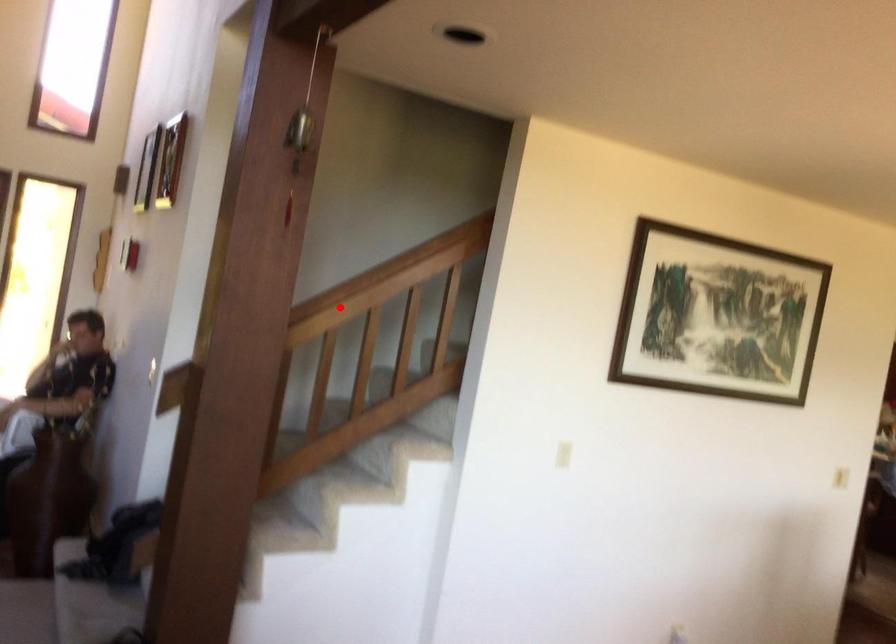
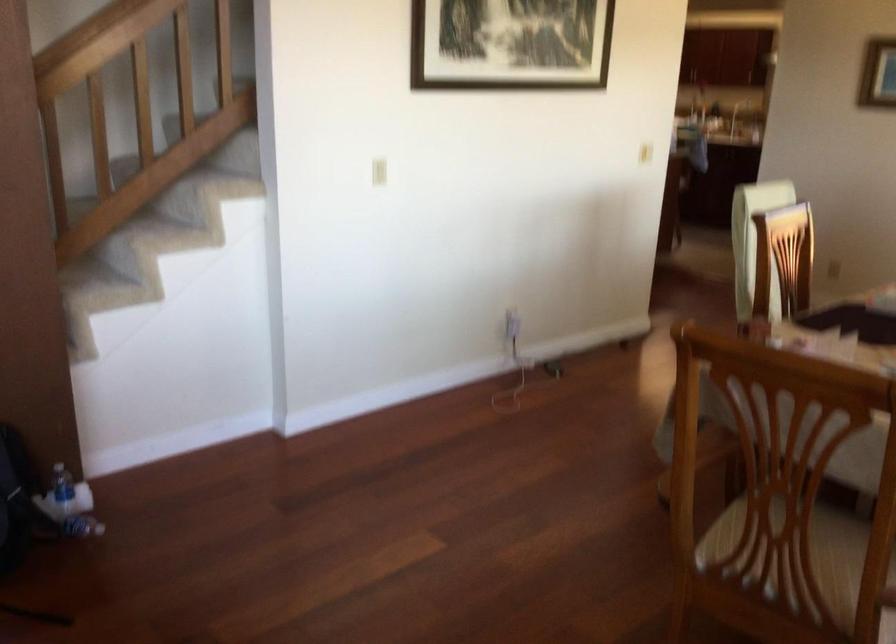
Question: I am providing you with two images of the same scene from different viewpoints. Image1 has a red point marked. In image2, the corresponding 3D location appears at what relative position? Reply with the corresponding letter.

Choices:
 (A) Closer
 (B) Farther

Answer: (A)